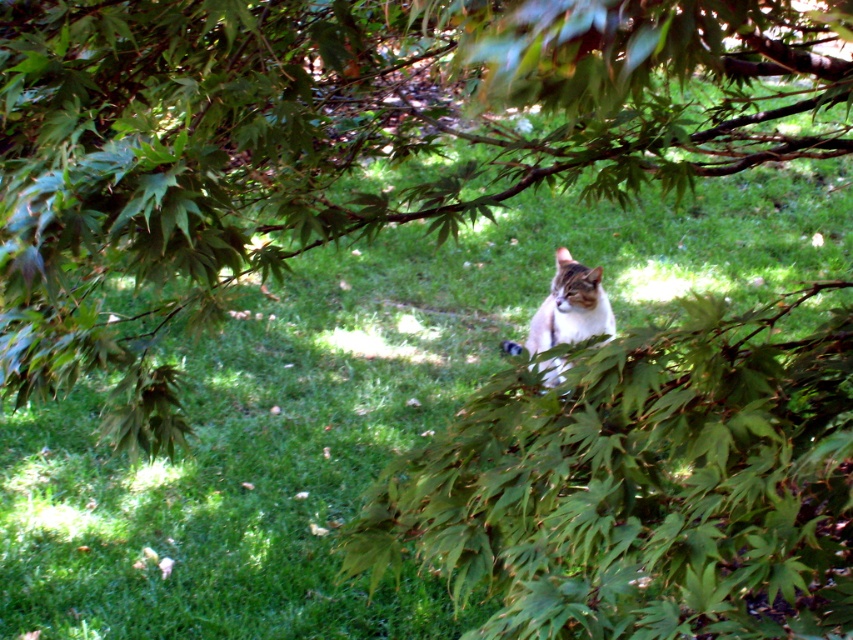
You are a photographer trying to capture the tabby fur cat at center and the green leafy tree at center in the same frame. Based on their sizes in the image, which one appears taller?

The green leafy tree at center appears taller than the tabby fur cat at center in the image.